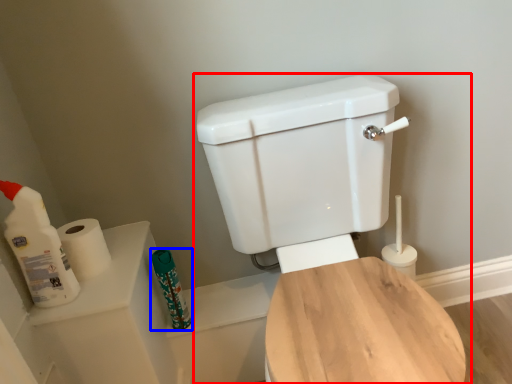
Question: Which of the following is the farthest to the observer, toilet (highlighted by a red box) or toiletry (highlighted by a blue box)?

Choices:
 (A) toilet
 (B) toiletry

Answer: (B)